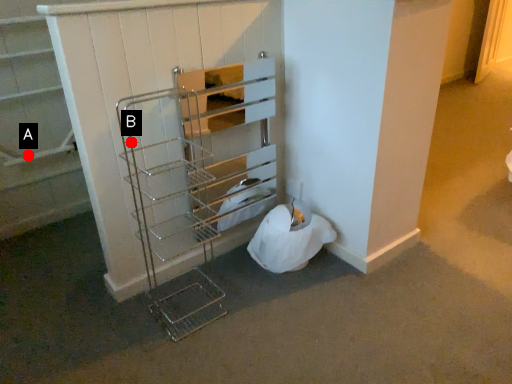
Question: Two points are circled on the image, labeled by A and B beside each circle. Which point is further to the camera?

Choices:
 (A) A is further
 (B) B is further

Answer: (A)